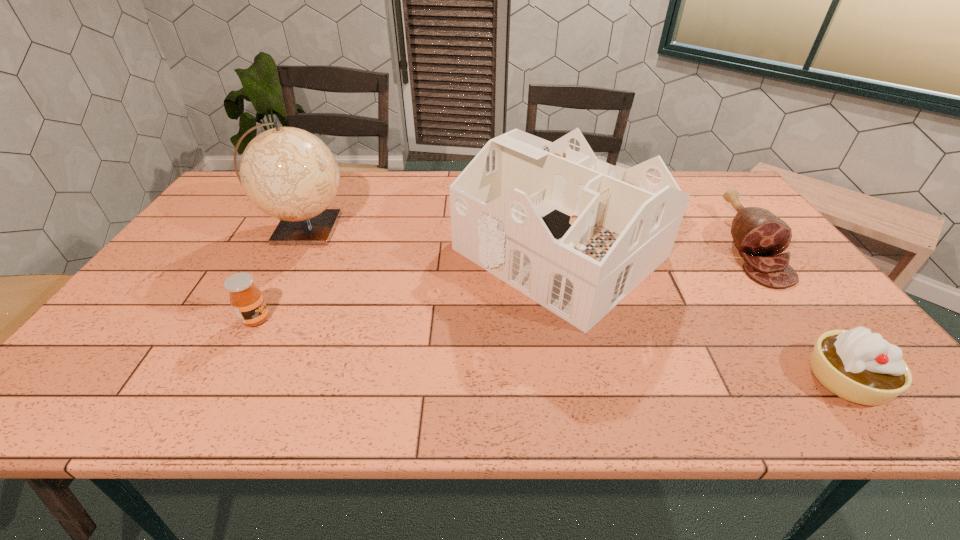
The width and height of the screenshot is (960, 540). In order to click on free spot that satisfies the following two spatial constraints: 1. on the surface of the third object from left to right showing Europe and Africa; 2. on the left side of the globe in this screenshot , I will do `click(291, 253)`.

This screenshot has width=960, height=540. Find the location of `free point that satisfies the following two spatial constraints: 1. on the front-facing side of the honey; 2. on the back side of the nearest object`. free point that satisfies the following two spatial constraints: 1. on the front-facing side of the honey; 2. on the back side of the nearest object is located at coordinates (225, 379).

At what (x,y) coordinates should I click in order to perform the action: click on free space that satisfies the following two spatial constraints: 1. at the sliced end of the ham; 2. on the front-facing side of the honey. Please return your answer as a coordinate pair (x, y). The width and height of the screenshot is (960, 540). Looking at the image, I should click on (804, 319).